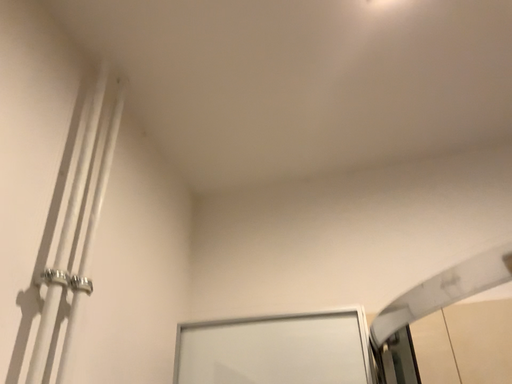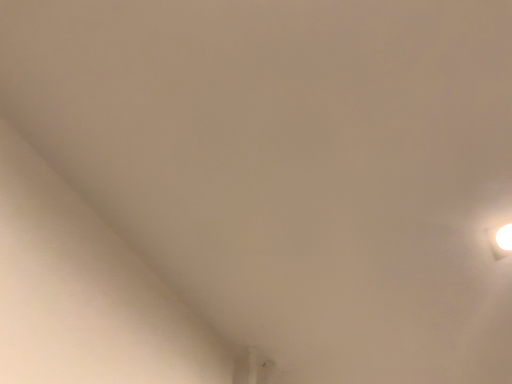
Question: Which way did the camera rotate in the video?

Choices:
 (A) rotated left
 (B) rotated right

Answer: (A)